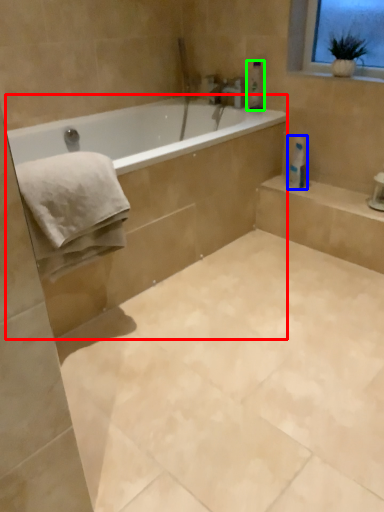
Question: Which object is positioned farthest from bath (highlighted by a red box)? Select from toilet paper (highlighted by a blue box) and toiletry (highlighted by a green box).

Choices:
 (A) toilet paper
 (B) toiletry

Answer: (B)